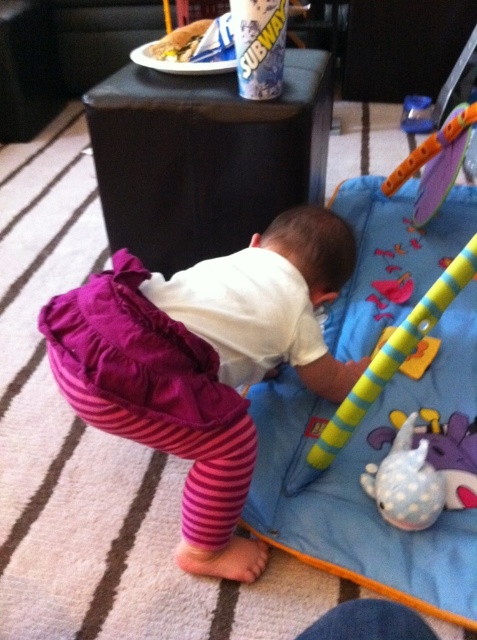
Question: Can you confirm if pink fabric pants at center is positioned to the right of white dotted fabric toy at lower right?

Choices:
 (A) no
 (B) yes

Answer: (A)

Question: Among these objects, which one is farthest from the camera?

Choices:
 (A) pink fabric pants at center
 (B) white dotted fabric toy at lower right
 (C) blue soft play mat at center

Answer: (B)

Question: Based on their relative distances, which object is farther from the blue soft play mat at center?

Choices:
 (A) white dotted fabric toy at lower right
 (B) pink fabric pants at center

Answer: (A)

Question: Among these points, which one is nearest to the camera?

Choices:
 (A) (146, 316)
 (B) (406, 420)
 (C) (327, 509)

Answer: (A)

Question: Is pink fabric pants at center further to the viewer compared to white dotted fabric toy at lower right?

Choices:
 (A) yes
 (B) no

Answer: (B)

Question: Is blue soft play mat at center positioned at the back of white dotted fabric toy at lower right?

Choices:
 (A) no
 (B) yes

Answer: (A)